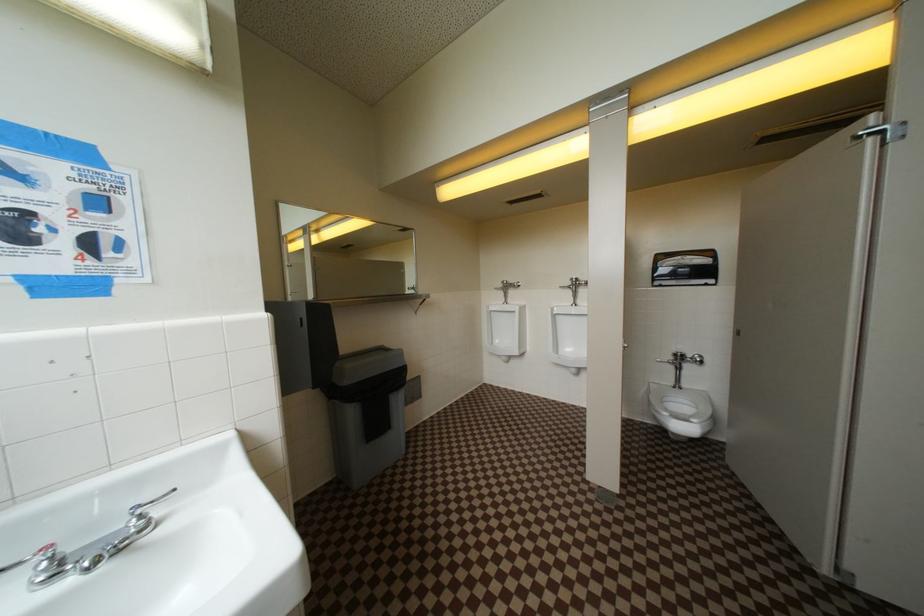
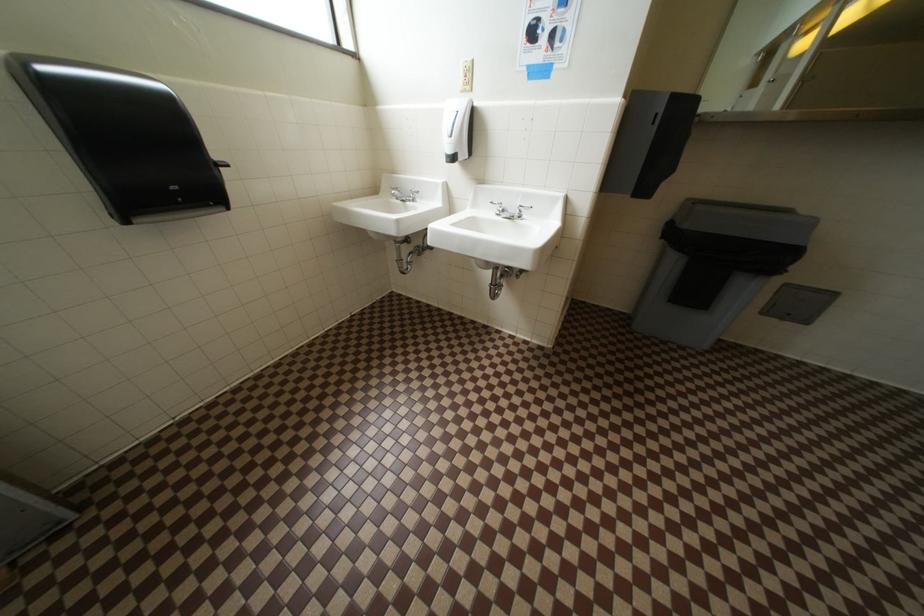
How did the camera likely rotate?

The camera's rotation is toward left-down.